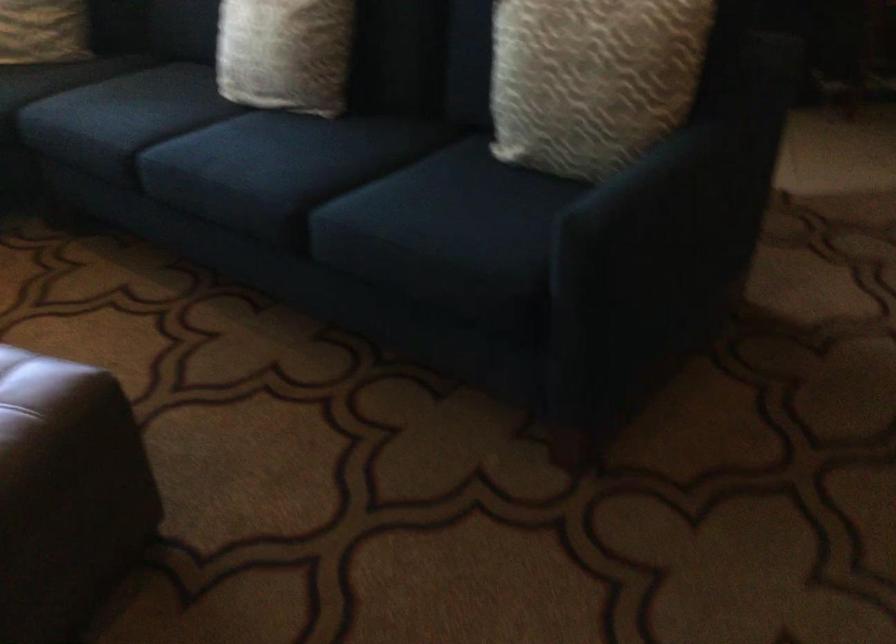
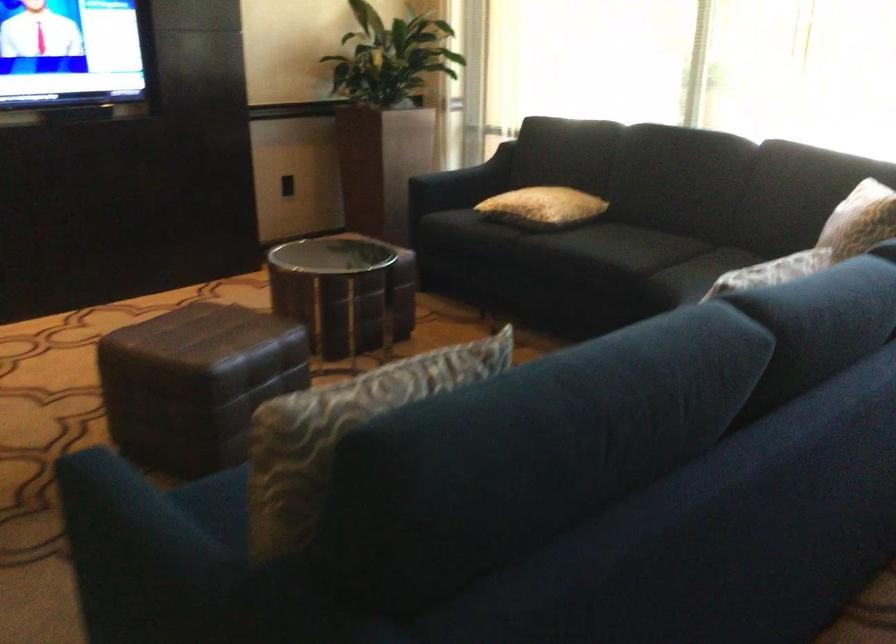
Where in the second image is the point corresponding to (x=670, y=169) from the first image?

(134, 534)